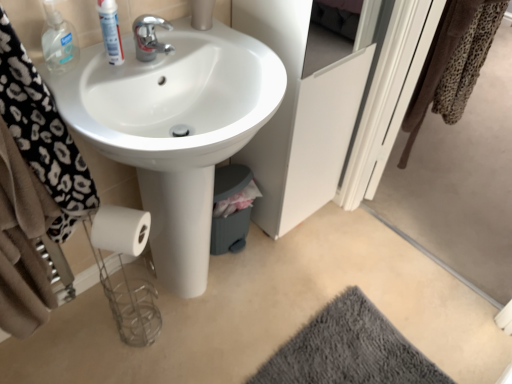
At what (x,y) coordinates should I click in order to perform the action: click on free region under black leopard print towel at left (from a real-world perspective). Please return your answer as a coordinate pair (x, y). Image resolution: width=512 pixels, height=384 pixels. Looking at the image, I should click on (75, 327).